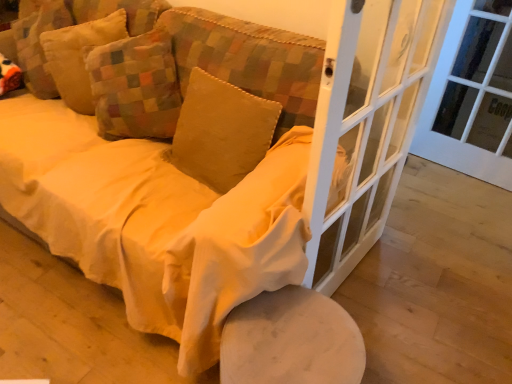
Where is `free space above white marble stool at lower center (from a real-world perspective)`? free space above white marble stool at lower center (from a real-world perspective) is located at coordinates (275, 344).